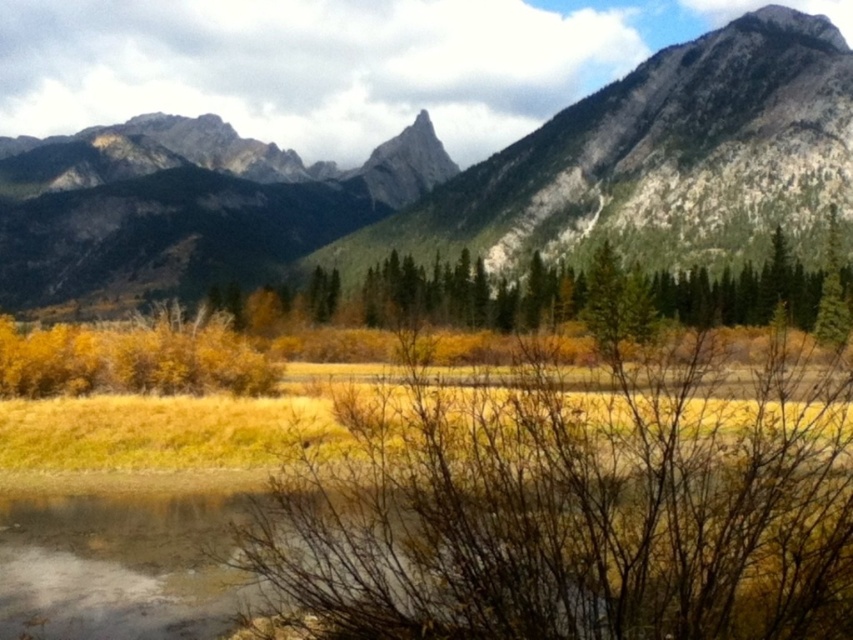
You are standing in the middle of the golden grassy meadow and see the point labeled as point (120, 552). Based on the scene description, what is the most likely material located at that point?

The point (120, 552) corresponds to brown dirt at lower left.

Looking at this image, you are standing in the meadow and want to walk towards the green coniferous trees at center. Which direction should you head to avoid the brown dirt at lower left?

To reach the green coniferous trees at center while avoiding the brown dirt at lower left, you should head towards the right side since the brown dirt at lower left is closer to you and located to the left of the trees.

You are standing in the meadow and want to take a photo of the rocky gray mountain range at upper center and the brown dirt at lower left. Which object should you point your camera towards first if you want to capture both in a single shot?

You should point your camera towards the brown dirt at lower left first because the rocky gray mountain range at upper center is positioned on the left side of it, meaning they are aligned horizontally. By centering the brown dirt at lower left, you can adjust the camera angle to include both objects in the frame.